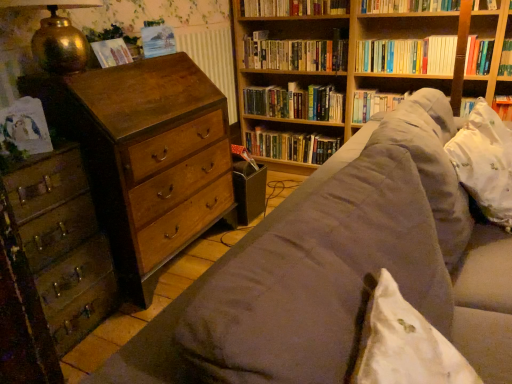
Question: Could hardcover books at upper right, the fourth book positioned from the top, be considered to be inside wooden chest of drawers at left, placed as the second chest of drawers when sorted from left to right?

Choices:
 (A) yes
 (B) no

Answer: (B)

Question: Is wooden chest of drawers at left, which is the 1th chest of drawers from right to left, with hardcover books at upper right, which ranks as the third book in bottom-to-top order?

Choices:
 (A) yes
 (B) no

Answer: (B)

Question: Is wooden chest of drawers at left, placed as the second chest of drawers when sorted from left to right, oriented towards hardcover books at upper right, the fourth book positioned from the top?

Choices:
 (A) yes
 (B) no

Answer: (B)

Question: From the image's perspective, is wooden chest of drawers at left, placed as the second chest of drawers when sorted from left to right, above hardcover books at upper right, the fourth book positioned from the top?

Choices:
 (A) no
 (B) yes

Answer: (A)

Question: Would you say wooden chest of drawers at left, placed as the second chest of drawers when sorted from left to right, is outside hardcover books at upper right, the fourth book positioned from the top?

Choices:
 (A) yes
 (B) no

Answer: (A)

Question: In terms of height, does white floral fabric pillow at right look taller or shorter compared to green matte bookshelf at center, which ranks as the 5th book in top-to-bottom order?

Choices:
 (A) tall
 (B) short

Answer: (A)

Question: Considering the positions of white floral fabric pillow at right and green matte bookshelf at center, positioned as the 2th book in bottom-to-top order, in the image, is white floral fabric pillow at right bigger or smaller than green matte bookshelf at center, positioned as the 2th book in bottom-to-top order,?

Choices:
 (A) small
 (B) big

Answer: (A)

Question: Considering the positions of point 503,160 and point 254,92, is point 503,160 closer or farther from the camera than point 254,92?

Choices:
 (A) closer
 (B) farther

Answer: (A)

Question: Considering their positions, is white floral fabric pillow at right located in front of or behind green matte bookshelf at center, which ranks as the 5th book in top-to-bottom order?

Choices:
 (A) behind
 (B) front

Answer: (B)

Question: Considering the positions of wooden chest of drawers at left, which is the 1th chest of drawers from right to left, and wooden chest of drawers at left, arranged as the first chest of drawers when viewed from the left, in the image, is wooden chest of drawers at left, which is the 1th chest of drawers from right to left, taller or shorter than wooden chest of drawers at left, arranged as the first chest of drawers when viewed from the left,?

Choices:
 (A) tall
 (B) short

Answer: (A)

Question: From a real-world perspective, is wooden chest of drawers at left, which is the 1th chest of drawers from right to left, positioned above or below wooden chest of drawers at left, the second chest of drawers viewed from the right?

Choices:
 (A) above
 (B) below

Answer: (A)

Question: Is point (133, 196) closer or farther from the camera than point (10, 297)?

Choices:
 (A) closer
 (B) farther

Answer: (B)

Question: Looking at the image, does wooden chest of drawers at left, which is the 1th chest of drawers from right to left, seem bigger or smaller compared to wooden chest of drawers at left, the second chest of drawers viewed from the right?

Choices:
 (A) big
 (B) small

Answer: (A)

Question: Considering their positions, is hardcover book at upper center, placed as the 5th book when sorted from bottom to top, located in front of or behind wooden bookshelf at upper right?

Choices:
 (A) front
 (B) behind

Answer: (B)

Question: Based on their sizes in the image, would you say hardcover book at upper center, placed as the 5th book when sorted from bottom to top, is bigger or smaller than wooden bookshelf at upper right?

Choices:
 (A) small
 (B) big

Answer: (A)